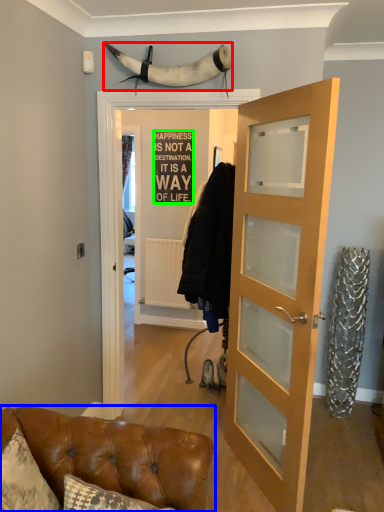
Question: Which is farther away from animal (highlighted by a red box)? furniture (highlighted by a blue box) or writing (highlighted by a green box)?

Choices:
 (A) furniture
 (B) writing

Answer: (B)